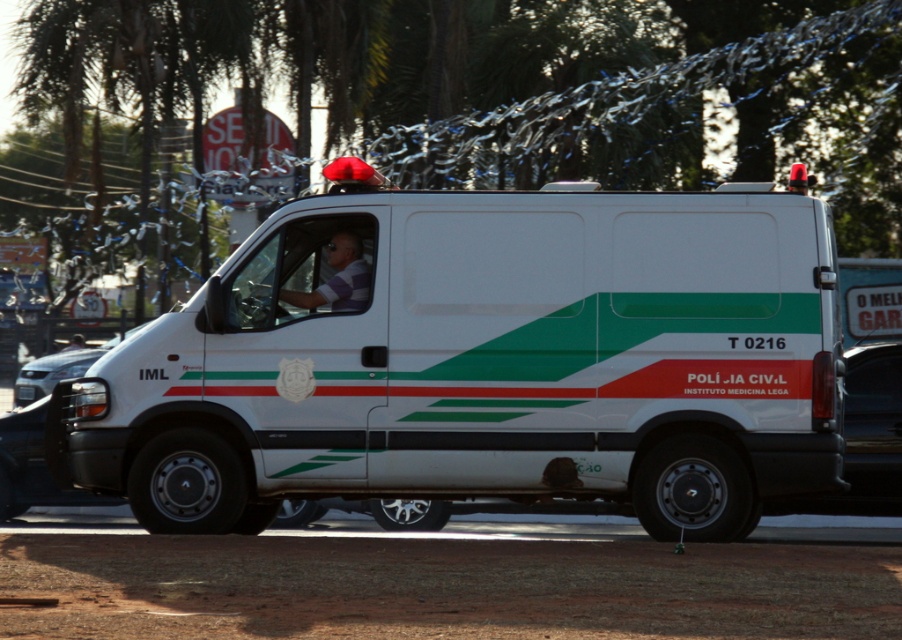
Can you confirm if matte white headlight at left is taller than white glossy van at center?

Yes.

In the scene shown: Can you confirm if matte white headlight at left is smaller than white glossy van at center?

Incorrect, matte white headlight at left is not smaller in size than white glossy van at center.

Does point (49, 384) lie behind point (70, 346)?

No, (49, 384) is closer to viewer.

Locate an element on the screen. This screenshot has height=640, width=902. matte white headlight at left is located at coordinates (51, 372).

Consider the image. Which is more to the right, white striped shirt at center or white glossy van at center?

white striped shirt at center is more to the right.

Does point (339, 305) come farther from viewer compared to point (71, 342)?

No, it is not.

What are the coordinates of `white striped shirt at center` in the screenshot? It's located at (337, 278).

Does point (776, 444) lie in front of point (54, 381)?

Yes, point (776, 444) is in front of point (54, 381).

Is white matte van at center above matte white headlight at left?

Correct, white matte van at center is located above matte white headlight at left.

Which is in front, point (620, 406) or point (88, 353)?

Point (620, 406) is in front.

Where is `white matte van at center`? The width and height of the screenshot is (902, 640). white matte van at center is located at coordinates (484, 362).